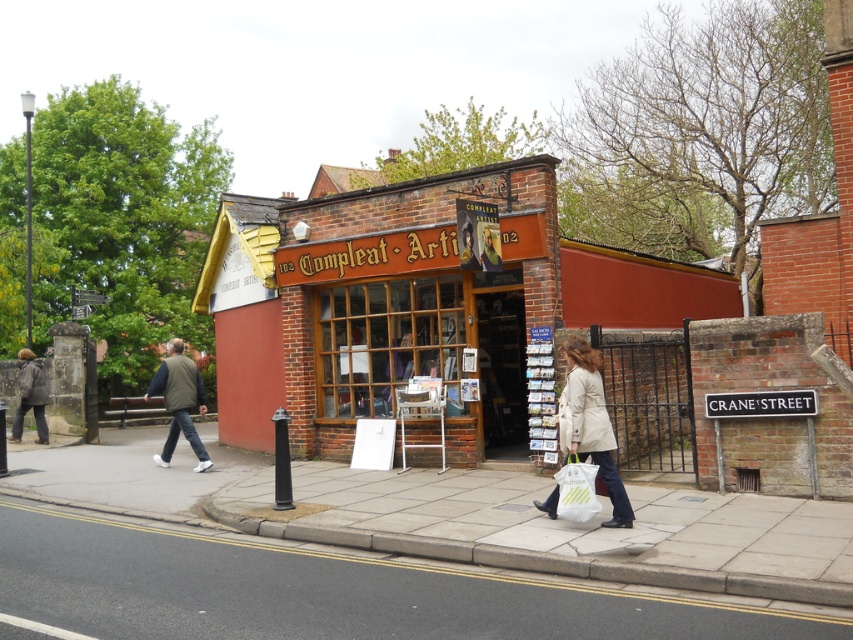
You are a delivery person who needs to place a package on the sidewalk between the white plastic bag at lower right and the smooth brown leather jacket at center. The package is 10 feet long. Will it fit between them?

The distance between the white plastic bag at lower right and the smooth brown leather jacket at center is 11.42 feet. Since the package is 10 feet long, it will fit between them with 1.42 feet of space remaining.

Consider the image. You are standing at point [480,252] and want to walk to the Compleat Art building. There is a point [572,474] in your path. Can you walk straight ahead without changing direction?

Yes, you can walk straight ahead without changing direction because point [572,474] is in front of point [480,252], meaning it lies along your path towards the Compleat Art building.